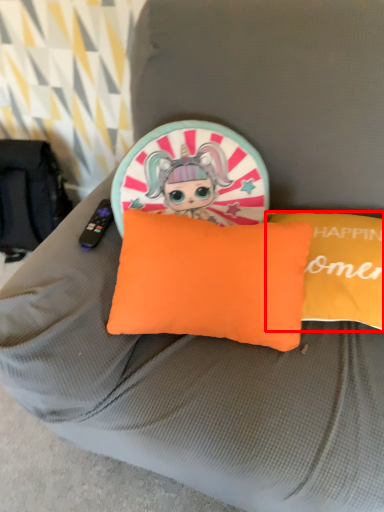
Question: From the image's perspective, where is pillow (annotated by the red box) located in relation to pillow in the image?

Choices:
 (A) above
 (B) below

Answer: (A)